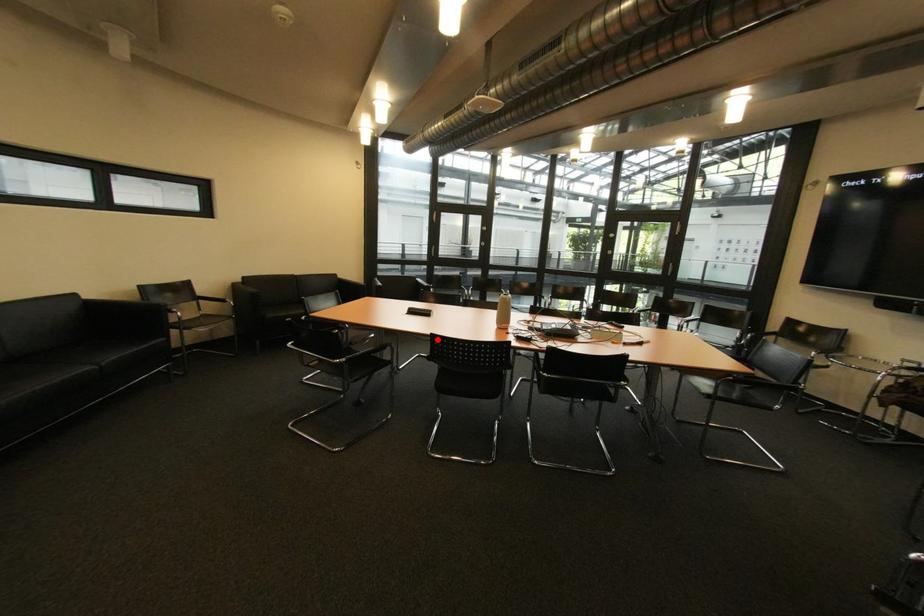
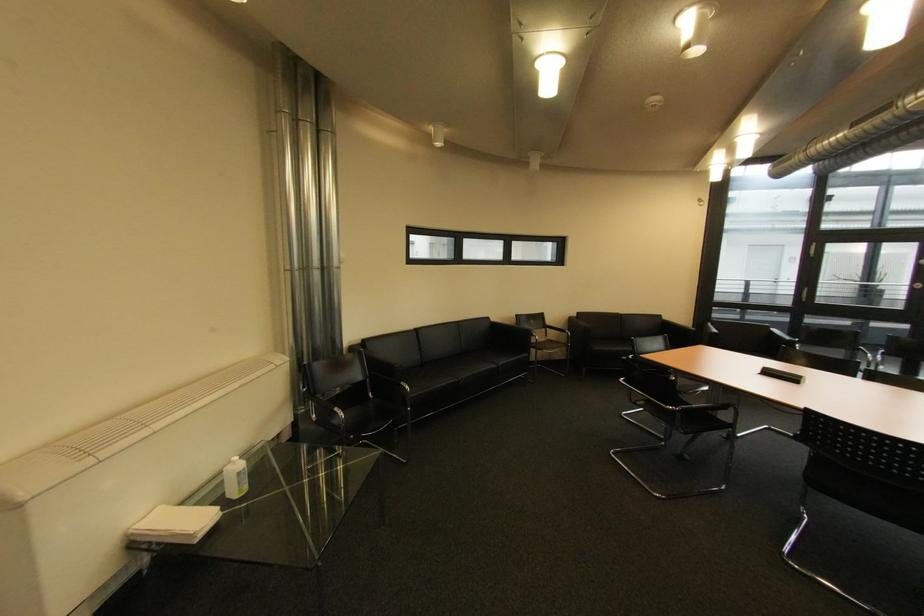
Find the pixel in the second image that matches the highlighted location in the first image.

(809, 415)